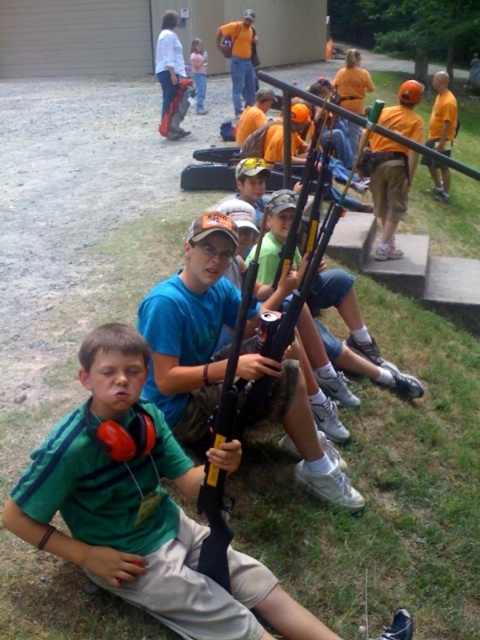
Locate an element on the screen. green matte shirt at lower left is located at coordinates (141, 512).

Looking at this image, who is more forward, (190, 490) or (197, 61)?

Positioned in front is point (190, 490).

Where is `green matte shirt at lower left`? green matte shirt at lower left is located at coordinates (141, 512).

Identify the location of green matte shirt at lower left. The height and width of the screenshot is (640, 480). (141, 512).